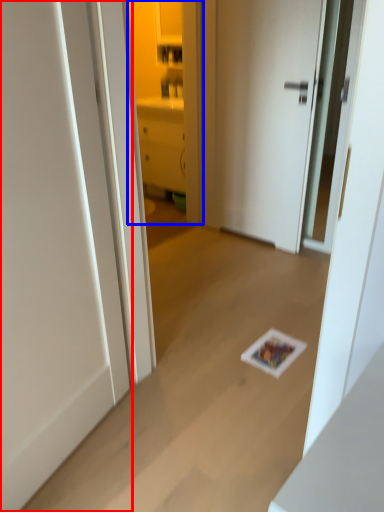
Question: Which point is further to the camera, door (highlighted by a red box) or cabinetry (highlighted by a blue box)?

Choices:
 (A) door
 (B) cabinetry

Answer: (B)